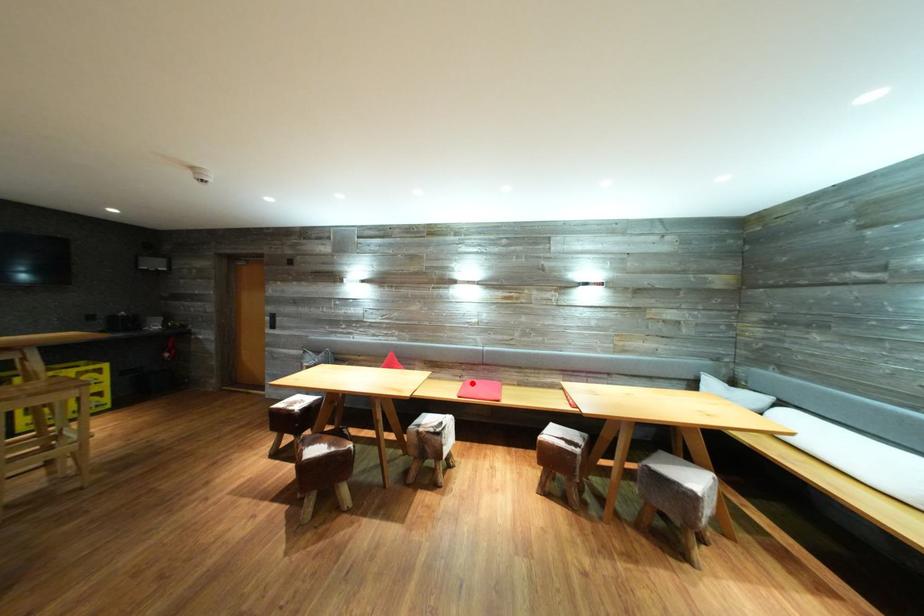
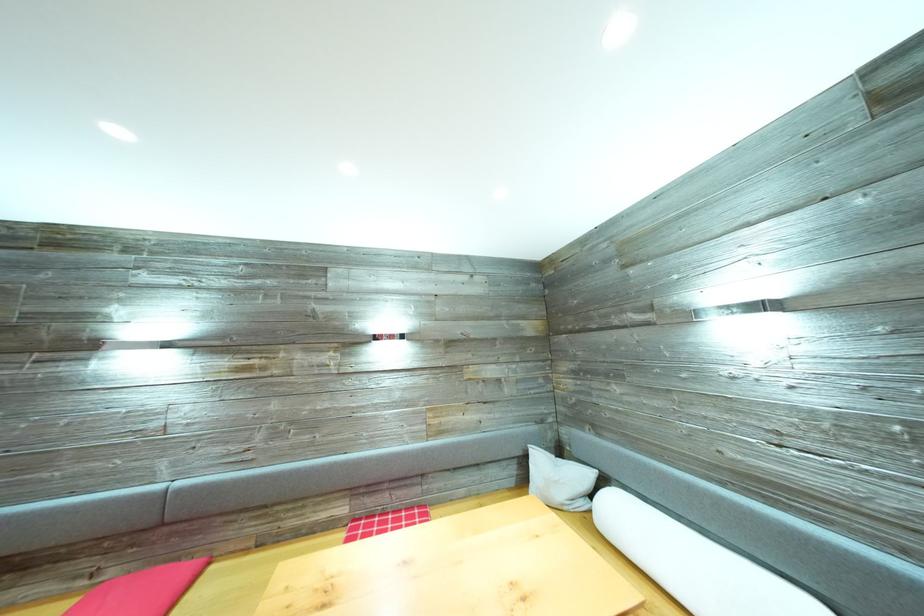
Where in the second image is the point corresponding to the highlighted location from the first image?

(117, 578)